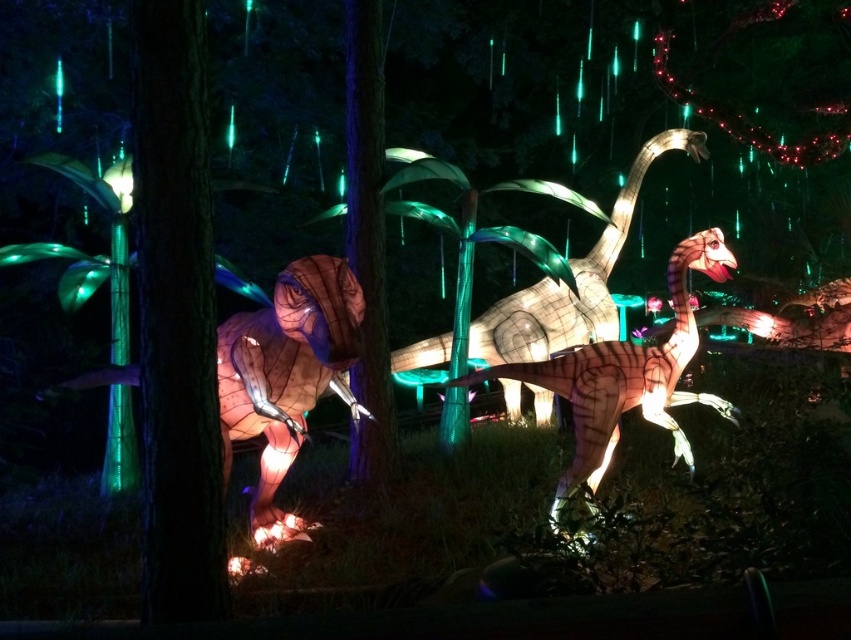
Which of these two, translucent paper dinosaur at left or translucent white dinosaur at center, stands shorter?

Standing shorter between the two is translucent paper dinosaur at left.

Is translucent paper dinosaur at left smaller than translucent white dinosaur at center?

Correct, translucent paper dinosaur at left occupies less space than translucent white dinosaur at center.

I want to click on translucent paper dinosaur at left, so click(x=286, y=374).

Is translucent paper dinosaur at left wider than matte brown dinosaur at center?

In fact, translucent paper dinosaur at left might be narrower than matte brown dinosaur at center.

Can you confirm if translucent paper dinosaur at left is positioned to the right of matte brown dinosaur at center?

No, translucent paper dinosaur at left is not to the right of matte brown dinosaur at center.

Is point (261, 486) farther from viewer compared to point (683, 276)?

Yes, point (261, 486) is behind point (683, 276).

I want to click on translucent paper dinosaur at left, so click(286, 374).

Who is taller, matte brown dinosaur at center or translucent white dinosaur at center?

With more height is translucent white dinosaur at center.

Does matte brown dinosaur at center appear on the left side of translucent white dinosaur at center?

Yes, matte brown dinosaur at center is to the left of translucent white dinosaur at center.

I want to click on matte brown dinosaur at center, so click(625, 376).